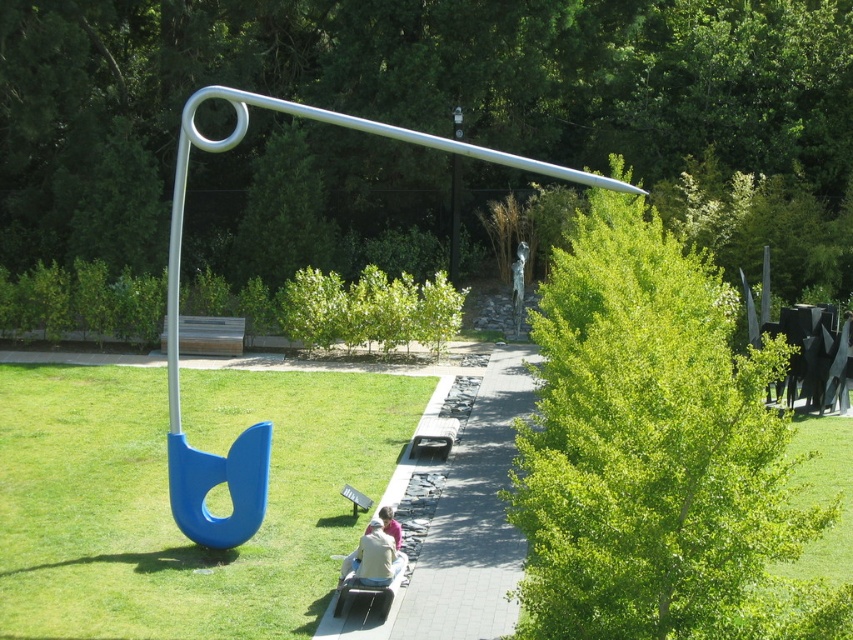
Question: Does green leafy tree at center right come behind paved stone path at center?

Choices:
 (A) yes
 (B) no

Answer: (B)

Question: Does green leafy tree at center right appear on the left side of metallic gray bench at center?

Choices:
 (A) no
 (B) yes

Answer: (A)

Question: Considering the relative positions of green grass at lower left and metallic gray bench at center in the image provided, where is green grass at lower left located with respect to metallic gray bench at center?

Choices:
 (A) left
 (B) right

Answer: (A)

Question: Which point appears closest to the camera in this image?

Choices:
 (A) (514, 380)
 (B) (231, 348)
 (C) (48, 10)
 (D) (364, 541)

Answer: (D)

Question: Which of the following is the farthest from the observer?

Choices:
 (A) green leafy tree at upper center
 (B) metallic gray bench at center
 (C) metallic silver bench at center

Answer: (A)

Question: Which of these objects is positioned closest to the paved stone path at center?

Choices:
 (A) green leafy tree at upper center
 (B) wooden park bench at center
 (C) light brown leather jacket at center
 (D) metallic gray bench at center

Answer: (D)